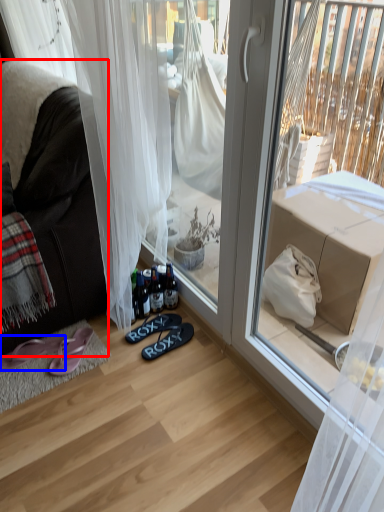
Question: Which object appears closest to the camera in this image, studio couch (highlighted by a red box) or footwear (highlighted by a blue box)?

Choices:
 (A) studio couch
 (B) footwear

Answer: (A)